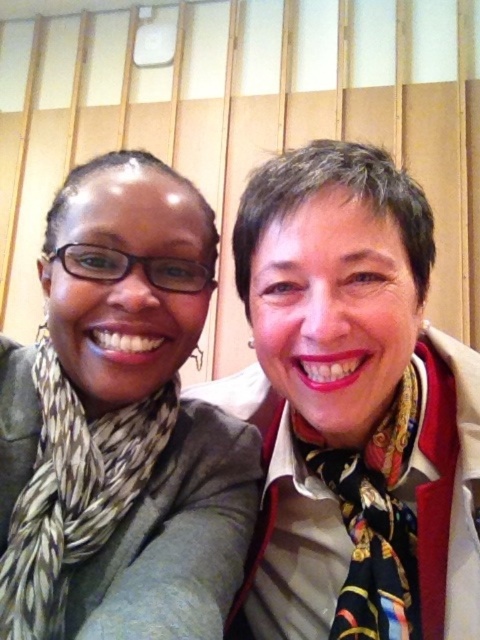
Which is more to the right, printed silk scarf at left or multicolored silk scarf at center?

From the viewer's perspective, multicolored silk scarf at center appears more on the right side.

Looking at this image, does printed silk scarf at left appear on the right side of multicolored silk scarf at center?

No, printed silk scarf at left is not to the right of multicolored silk scarf at center.

Where is `printed silk scarf at left`? The width and height of the screenshot is (480, 640). printed silk scarf at left is located at coordinates (73, 493).